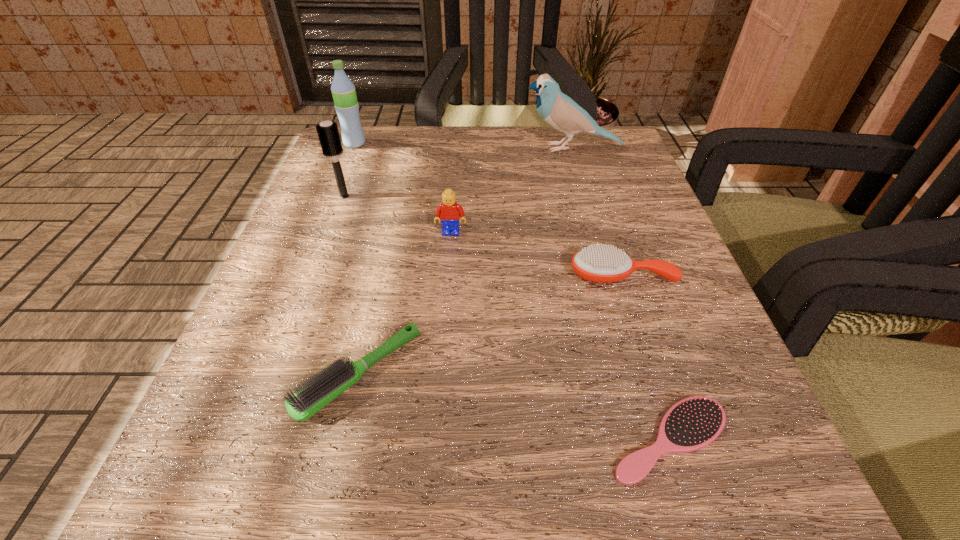
Find the location of a particular element. Image resolution: width=960 pixels, height=540 pixels. free area in between the bird and the fourth tallest object is located at coordinates (511, 191).

This screenshot has width=960, height=540. I want to click on free space between the third hairbrush from right to left and the shortest object, so click(515, 406).

I want to click on free spot between the bird and the fourth shortest object, so 511,191.

Identify the location of vacant space in between the fifth object from right to left and the fourth farthest object. The height and width of the screenshot is (540, 960). (405, 303).

What are the coordinates of `empty space that is in between the tallest hairbrush and the second tallest hairbrush` in the screenshot? It's located at (483, 235).

Identify the location of object that stands as the third closest to the water bottle. (562, 113).

Point out which object is positioned as the nearest to the water bottle. Please provide its 2D coordinates. Your answer should be formatted as a tuple, i.e. [(x, y)], where the tuple contains the x and y coordinates of a point satisfying the conditions above.

[(328, 133)]

Image resolution: width=960 pixels, height=540 pixels. In order to click on hairbrush that is the second nearest to the shortest hairbrush in this screenshot , I will do `click(331, 382)`.

Find the location of a particular element. This screenshot has height=540, width=960. the closest hairbrush to the shortest hairbrush is located at coordinates (599, 263).

Where is `free spot that satisfies the following two spatial constraints: 1. on the front side of the shortest hairbrush; 2. on the left side of the water bottle`? The height and width of the screenshot is (540, 960). free spot that satisfies the following two spatial constraints: 1. on the front side of the shortest hairbrush; 2. on the left side of the water bottle is located at coordinates (235, 438).